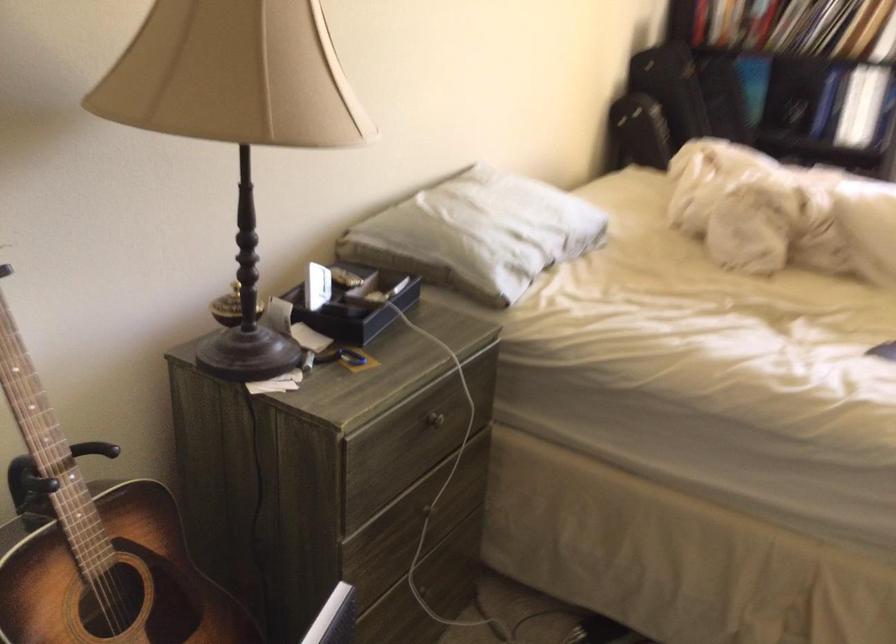
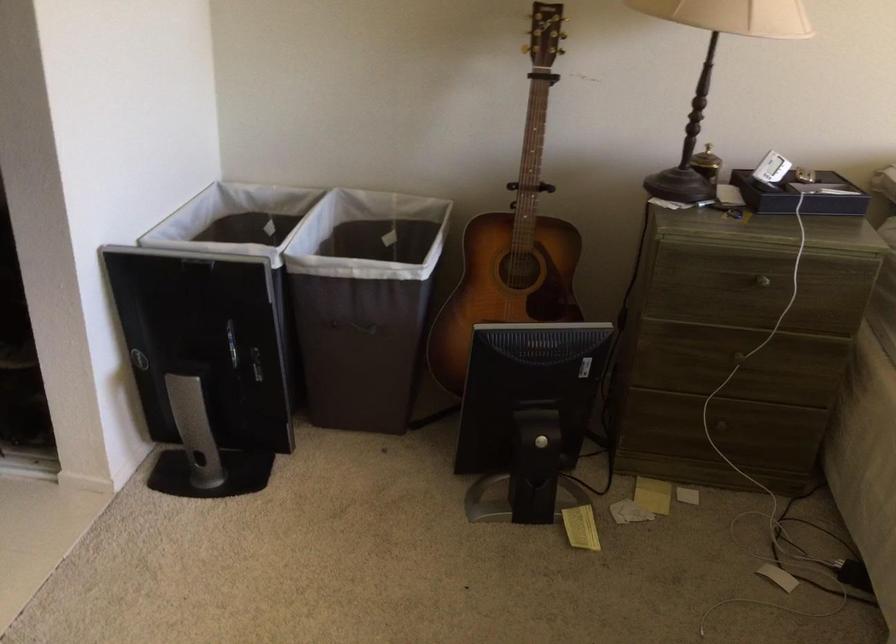
In the second image, find the point that corresponds to the point at 168,190 in the first image.

(714, 69)